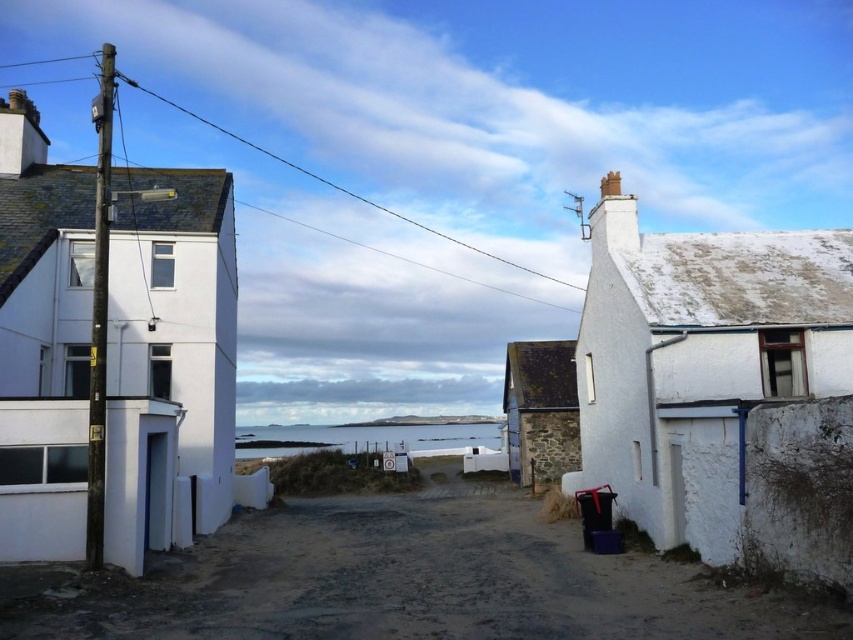
Question: Based on their relative distances, which object is nearer to the white matte house at left?

Choices:
 (A) rustic stone cottage at center
 (B) dirt ground at center

Answer: (B)

Question: From the image, what is the correct spatial relationship of white rough stone cottage at right in relation to rustic stone cottage at center?

Choices:
 (A) below
 (B) above

Answer: (B)

Question: Is white rough stone cottage at right positioned before rustic stone cottage at center?

Choices:
 (A) yes
 (B) no

Answer: (A)

Question: Can you confirm if white rough stone cottage at right is positioned above rustic stone cottage at center?

Choices:
 (A) yes
 (B) no

Answer: (A)

Question: Estimate the real-world distances between objects in this image. Which object is farther from the white rough stone cottage at right?

Choices:
 (A) rustic stone cottage at center
 (B) white matte house at left
 (C) dirt ground at center

Answer: (A)

Question: Estimate the real-world distances between objects in this image. Which object is farther from the rustic stone cottage at center?

Choices:
 (A) dirt ground at center
 (B) white matte house at left
 (C) white rough stone cottage at right

Answer: (B)